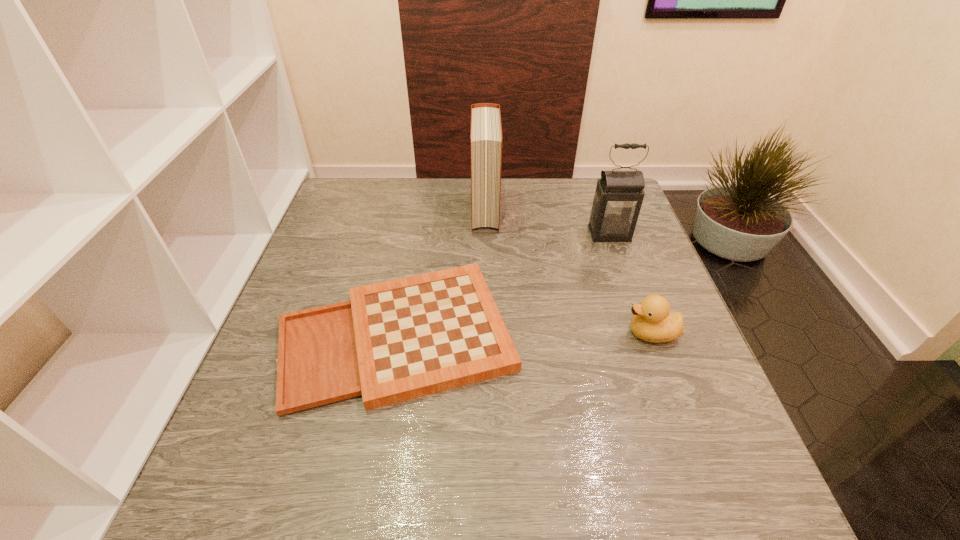
The height and width of the screenshot is (540, 960). I want to click on object present at the far edge, so click(486, 138).

Find the location of a particular element. This screenshot has height=540, width=960. object present at the left edge is located at coordinates (393, 341).

This screenshot has width=960, height=540. I want to click on lantern that is at the right edge, so click(618, 198).

The image size is (960, 540). In order to click on duckling situated at the right edge in this screenshot , I will do `click(653, 322)`.

In the image, there is a desktop. Where is `free space at the far edge`? This screenshot has height=540, width=960. free space at the far edge is located at coordinates (507, 205).

Image resolution: width=960 pixels, height=540 pixels. Find the location of `vacant area at the near edge of the desktop`. vacant area at the near edge of the desktop is located at coordinates (578, 509).

In the image, there is a desktop. Find the location of `vacant area at the left edge`. vacant area at the left edge is located at coordinates (368, 240).

In the image, there is a desktop. Identify the location of free space at the right edge. (718, 396).

Locate an element on the screen. vacant space that is in between the third tallest object and the gameboard is located at coordinates (524, 334).

Find the location of `free spot between the duckling and the lantern`. free spot between the duckling and the lantern is located at coordinates (630, 284).